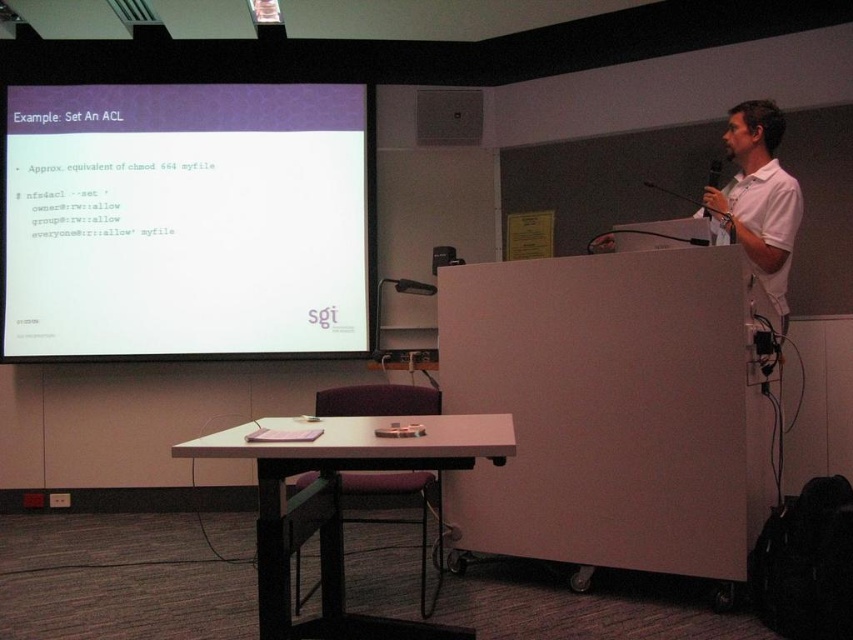
Question: Is white plastic podium at center thinner than white cotton shirt at upper right?

Choices:
 (A) no
 (B) yes

Answer: (A)

Question: In this image, where is white matte projector screen at upper left located relative to white plastic podium at center?

Choices:
 (A) above
 (B) below

Answer: (A)

Question: Can you confirm if white plastic podium at center is thinner than white cotton shirt at upper right?

Choices:
 (A) no
 (B) yes

Answer: (A)

Question: Which point appears closest to the camera in this image?

Choices:
 (A) (755, 257)
 (B) (466, 433)
 (C) (314, 205)

Answer: (B)

Question: Among these objects, which one is nearest to the camera?

Choices:
 (A) white cotton shirt at upper right
 (B) white matte projector screen at upper left
 (C) white plastic podium at center

Answer: (C)

Question: Which point is farther to the camera?

Choices:
 (A) (379, 616)
 (B) (236, 112)

Answer: (B)